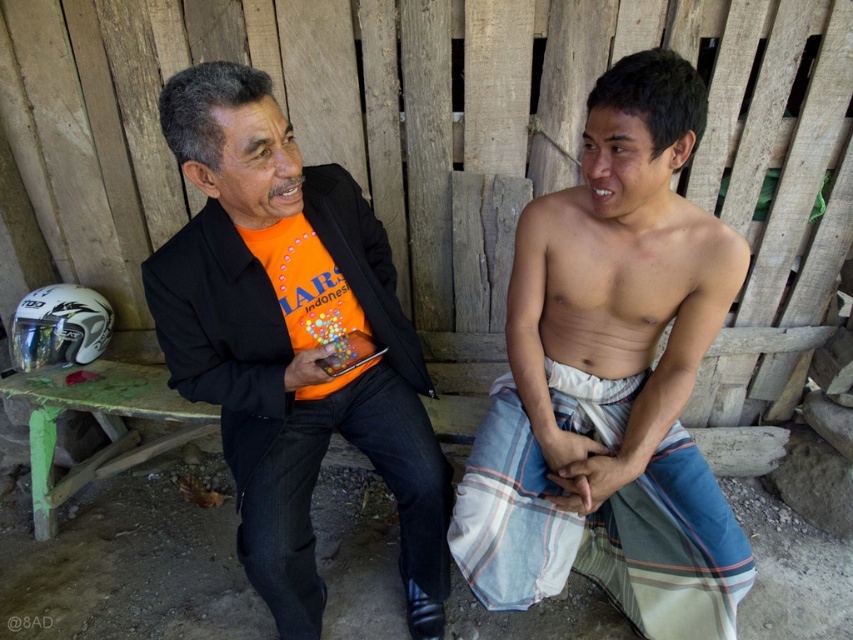
You are a photographer trying to capture both striped cotton sarong at center and striped cotton sarong at lower center in the same frame. Given that your camera has a maximum focus range of 3 inches, will you be able to get both in focus?

The striped cotton sarong at center and striped cotton sarong at lower center are 2.93 inches apart from each other. Since the distance between them is within the camera maximum focus range of 3 inches, you can capture both in focus.

You are a photographer setting up a shoot in a rustic outdoor setting. You need to ensure that the striped cotton sarong at center and the orange matte shirt at center are both visible in the frame. Given their sizes, which item should you position closer to the camera to maintain visibility?

The striped cotton sarong at center is much taller than the orange matte shirt at center. To ensure both are visible, position the orange matte shirt at center closer to the camera so its smaller size can be seen clearly alongside the taller sarong.

You are a photographer setting up a shoot in a rustic outdoor setting. You need to position a light source to the right of the orange matte shirt at center and to the left of the striped cotton sarong at lower center. Is this possible based on their positions?

The orange matte shirt at center is to the left of the striped cotton sarong at lower center, so placing a light source to the right of the orange matte shirt at center and to the left of the striped cotton sarong at lower center is possible between them.